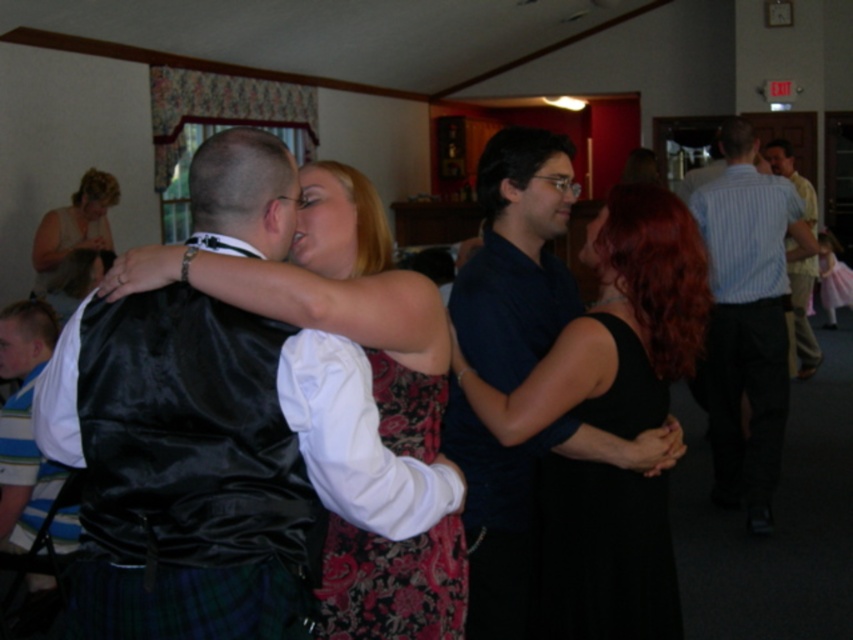
You are a photographer at a social event and want to capture both the light blue striped shirt at right and the matte black dress at upper left in a single photo. However, the camera can only focus on one subject at a time. Which subject should you focus on to ensure the other remains visible in the background?

You should focus on the light blue striped shirt at right since it is in front of the matte black dress at upper left, allowing the dress to stay visible in the background.

You are planning to take a photo of the light blue striped shirt at right and the matte black dress at upper left. The camera you have can capture objects within a 3 meter range. Will both subjects be in frame if they are positioned exactly 3.10 meters apart?

The light blue striped shirt at right and matte black dress at upper left are 3.10 meters apart, which exceeds the camera range of 3 meters. Therefore, both subjects cannot be captured in the same frame.